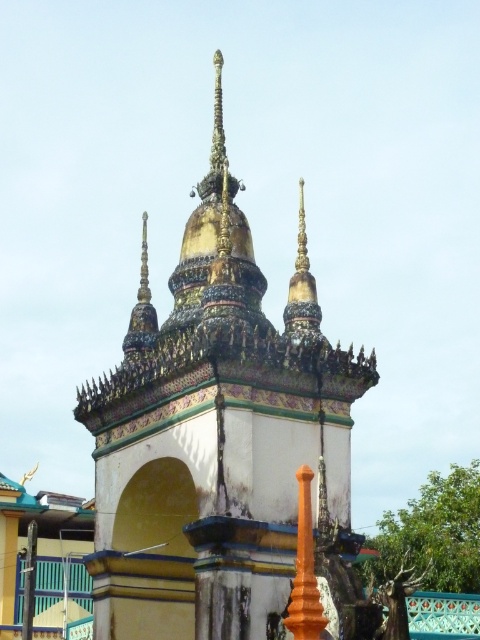
Between point (255, 632) and point (300, 472), which one is positioned behind?

Positioned behind is point (255, 632).

Which of these two, gold mosaic temple at center or orange polished pillar at center, stands taller?

gold mosaic temple at center is taller.

The width and height of the screenshot is (480, 640). Find the location of `gold mosaic temple at center`. gold mosaic temple at center is located at coordinates (214, 435).

The width and height of the screenshot is (480, 640). I want to click on gold mosaic temple at center, so click(214, 435).